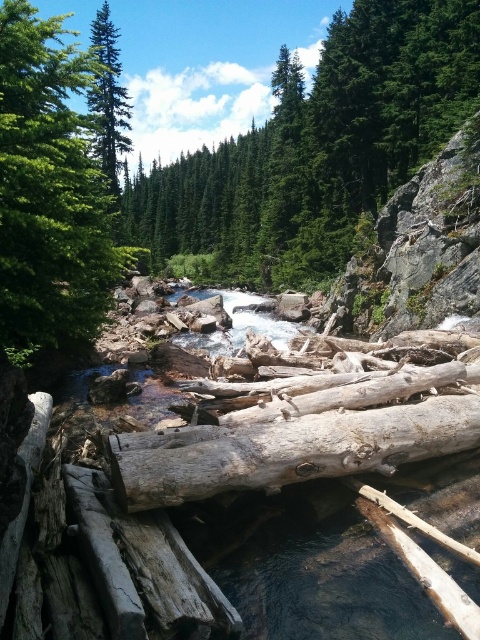
Question: Is weathered wood log at center below green matte tree at upper left?

Choices:
 (A) yes
 (B) no

Answer: (A)

Question: Can you confirm if green textured tree at upper left is positioned above weathered wood log at center?

Choices:
 (A) no
 (B) yes

Answer: (B)

Question: Which point is farther to the camera?

Choices:
 (A) green matte tree at upper left
 (B) green textured tree at upper center
 (C) green textured tree at upper left
 (D) weathered wood log at center

Answer: (B)

Question: Which object is positioned farthest from the green textured tree at upper left?

Choices:
 (A) green textured tree at upper center
 (B) green matte tree at upper left

Answer: (A)

Question: Which point is closer to the camera taking this photo?

Choices:
 (A) (147, 467)
 (B) (97, 60)
 (C) (92, 282)

Answer: (A)

Question: Where is green textured tree at upper center located in relation to green matte tree at upper left in the image?

Choices:
 (A) below
 (B) above

Answer: (B)